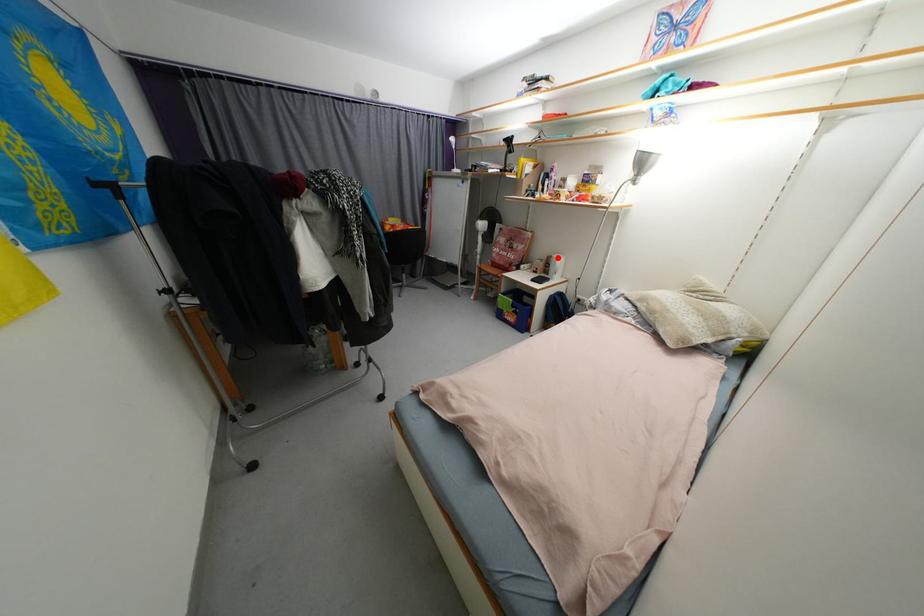
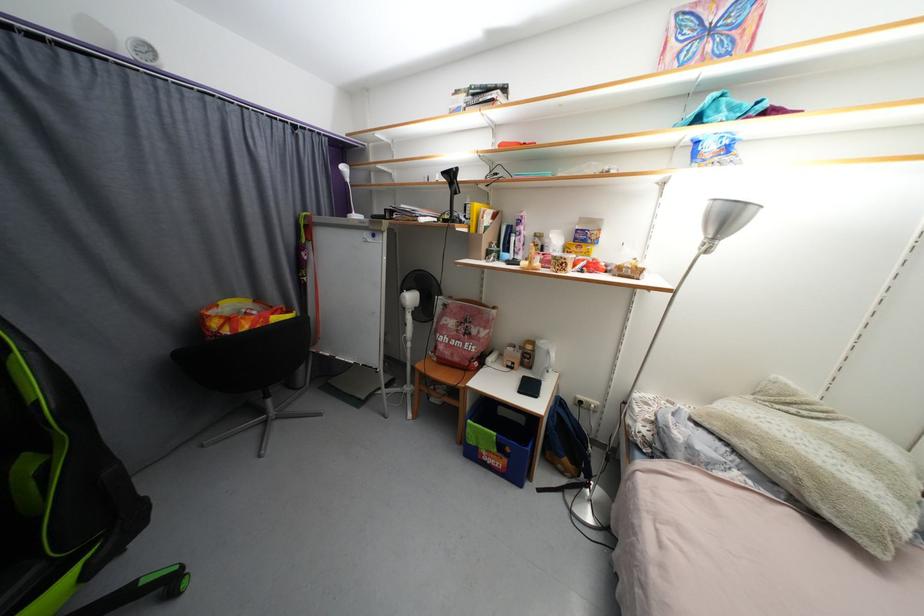
Question: I am providing you with two images of the same scene from different viewpoints. Given a red point in image1, look at the same physical point in image2. Is it:

Choices:
 (A) Closer to the viewpoint
 (B) Farther from the viewpoint

Answer: (B)